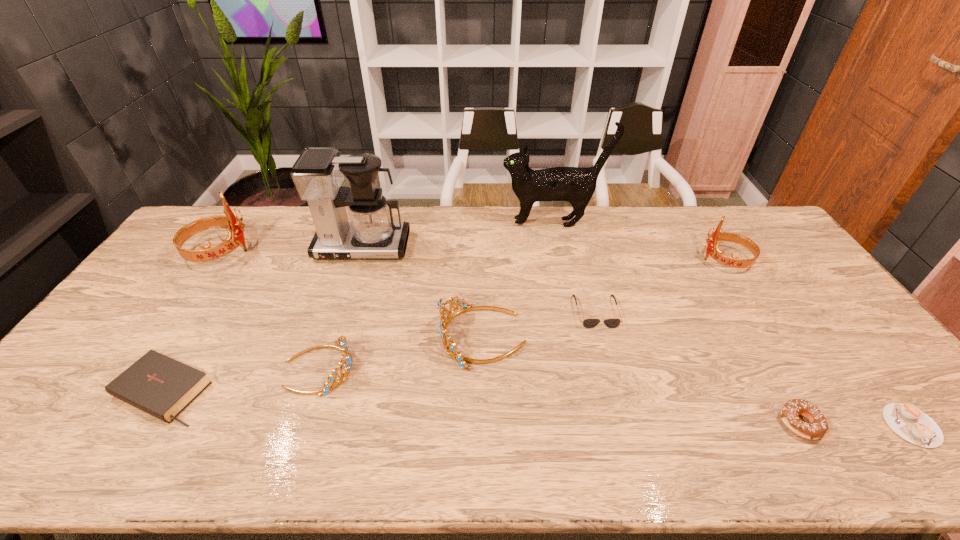
At what (x,y) coordinates should I click in order to perform the action: click on free space that satisfies the following two spatial constraints: 1. on the front-facing side of the third tiara from left to right; 2. on the left side of the rightmost object. Please return your answer as a coordinate pair (x, y). This screenshot has height=540, width=960. Looking at the image, I should click on pyautogui.click(x=484, y=425).

What are the coordinates of `blank space that satisfies the following two spatial constraints: 1. on the front-facing side of the sunglasses; 2. on the front-facing side of the bigger gold tiara` in the screenshot? It's located at (603, 337).

What are the coordinates of `blank space that satisfies the following two spatial constraints: 1. on the front-facing side of the sunglasses; 2. on the right side of the chocolate doughnut` in the screenshot? It's located at (626, 423).